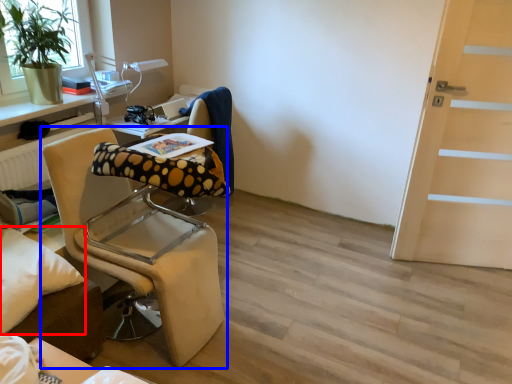
Question: Which point is closer to the camera, pillow (highlighted by a red box) or chair (highlighted by a blue box)?

Choices:
 (A) pillow
 (B) chair

Answer: (A)